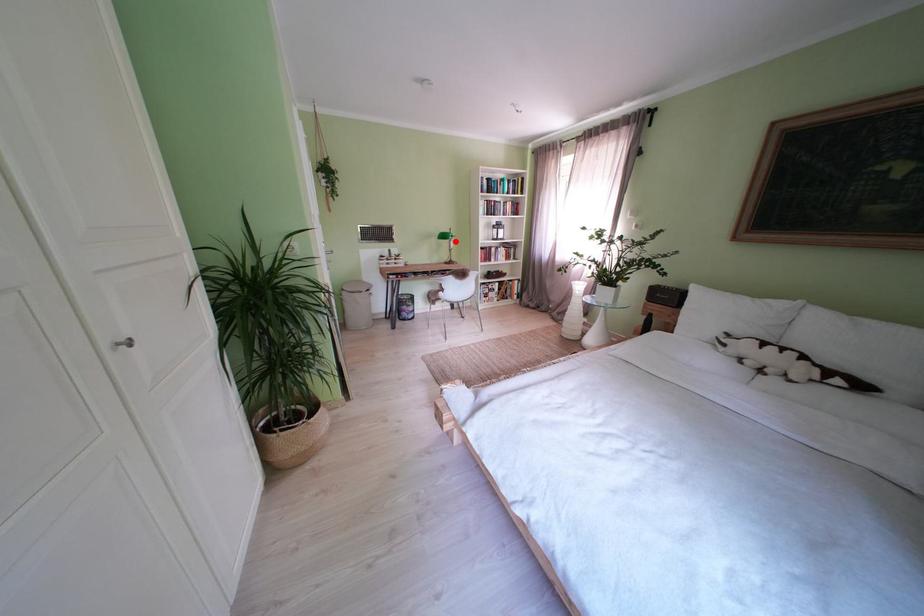
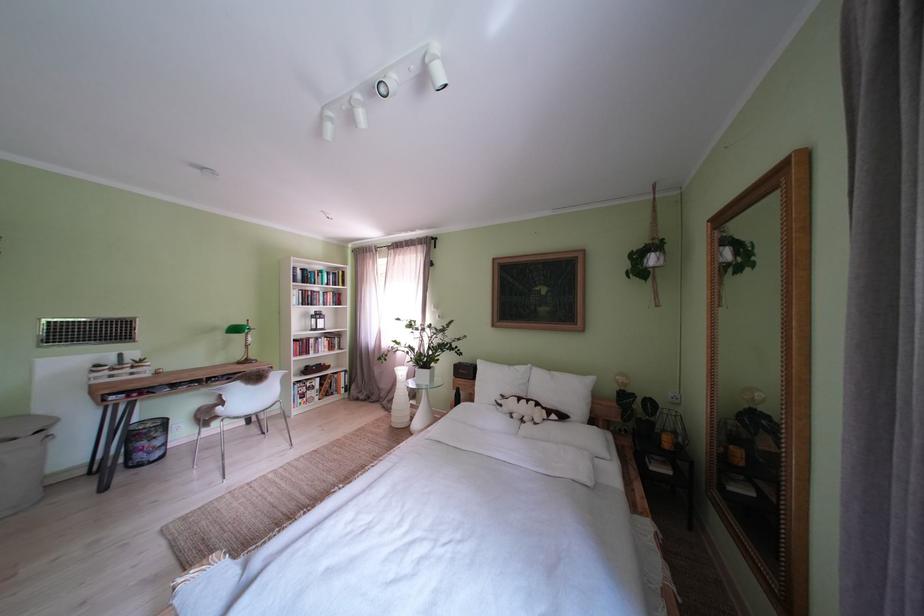
Question: I am providing you with two images of the same scene from different viewpoints. Given a red point in image1, look at the same physical point in image2. Is it:

Choices:
 (A) Closer to the viewpoint
 (B) Farther from the viewpoint

Answer: (B)